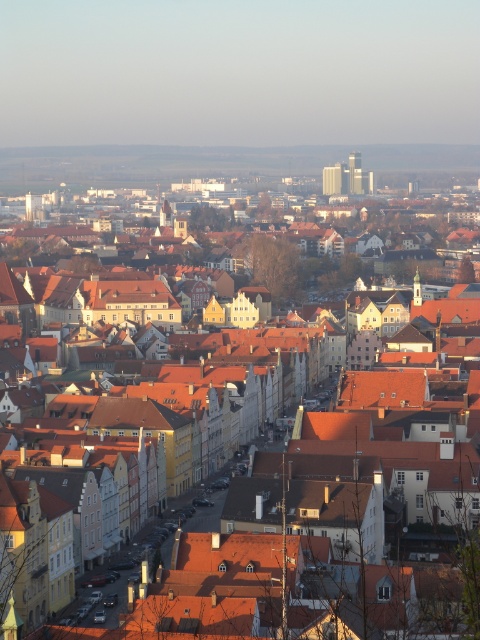
You are an urban planner assessing the skyline of this city. You notice the gray concrete skyscraper at upper center and the matte glass skyscraper at upper center. Which of these two buildings occupies more space in the skyline view?

The gray concrete skyscraper at upper center has a larger size compared to the matte glass skyscraper at upper center, so it occupies more space in the skyline view.

You are standing in the urban area shown in the image. You see two points marked as point 1 at coordinates (399, 484) and point 2 at coordinates (350, 186). Which point is closer to your current position?

Point 1 at coordinates (399, 484) is closer to your current position because it is closer to the camera than point 2 at coordinates (350, 186).

You are a city planner analyzing the urban layout. You observe the gray concrete skyscraper at upper center and the matte glass skyscraper at upper center. Which of these two skyscrapers is located to the right when viewed from the perspective of someone standing in the foreground looking towards the skyline?

The gray concrete skyscraper at upper center is positioned on the right side of the matte glass skyscraper at upper center, so it is the one located to the right.